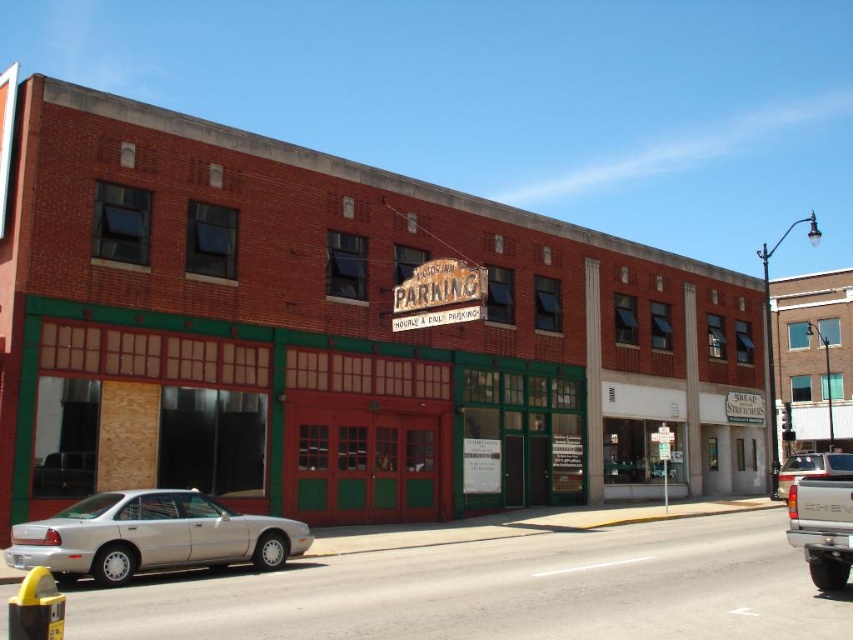
Between point (97, 557) and point (822, 460), which one is positioned behind?

Positioned behind is point (822, 460).

Between silver metallic sedan at lower left and white matte truck at lower right, which one appears on the right side from the viewer's perspective?

white matte truck at lower right is more to the right.

Does point (106, 515) come farther from viewer compared to point (833, 460)?

That is False.

Find the location of `silver metallic sedan at lower left`. silver metallic sedan at lower left is located at coordinates point(151,536).

Does silver metallic truck at lower right have a smaller size compared to white matte truck at lower right?

Indeed, silver metallic truck at lower right has a smaller size compared to white matte truck at lower right.

Is silver metallic truck at lower right further to camera compared to white matte truck at lower right?

No, silver metallic truck at lower right is closer to the viewer.

Does point (833, 499) come closer to viewer compared to point (817, 468)?

Yes, it is in front of point (817, 468).

The image size is (853, 640). Find the location of `silver metallic truck at lower right`. silver metallic truck at lower right is located at coordinates (822, 525).

Based on the photo, is silver metallic sedan at lower left to the left of silver metallic truck at lower right from the viewer's perspective?

Indeed, silver metallic sedan at lower left is positioned on the left side of silver metallic truck at lower right.

Between silver metallic sedan at lower left and silver metallic truck at lower right, which one appears on the right side from the viewer's perspective?

Positioned to the right is silver metallic truck at lower right.

You are a GUI agent. You are given a task and a screenshot of the screen. Output one action in this format:
    pyautogui.click(x=<x>, y=<y>)
    Task: Click on the silver metallic sedan at lower left
    
    Given the screenshot: What is the action you would take?
    pyautogui.click(x=151, y=536)